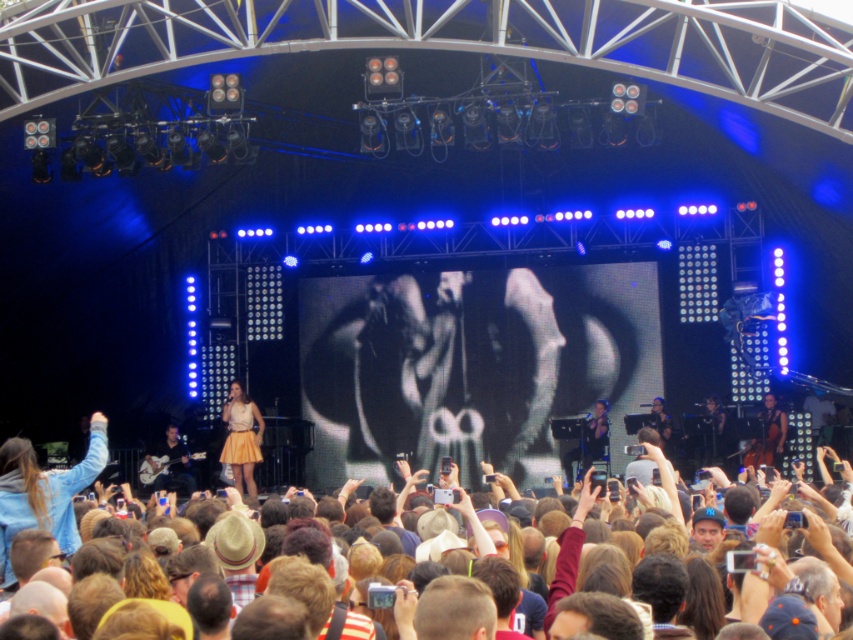
Question: Observing the image, what is the correct spatial positioning of brown hair at center in reference to yellow textured skirt at center?

Choices:
 (A) right
 (B) left

Answer: (A)

Question: Considering the relative positions of yellow textured skirt at center and dark blue fabric at center in the image provided, where is yellow textured skirt at center located with respect to dark blue fabric at center?

Choices:
 (A) below
 (B) above

Answer: (A)

Question: Which point is farther to the camera?

Choices:
 (A) (660, 412)
 (B) (401, 618)

Answer: (A)

Question: Among these objects, which one is nearest to the camera?

Choices:
 (A) dark blue fabric at center
 (B) brown hair at center

Answer: (B)

Question: Can you confirm if blue denim jacket at lower left is positioned to the right of dark blue fabric at center?

Choices:
 (A) no
 (B) yes

Answer: (A)

Question: Among these objects, which one is farthest from the camera?

Choices:
 (A) dark blue fabric at center
 (B) matte black guitar at lower left
 (C) brown hair at center
 (D) blue denim jacket at lower left

Answer: (B)